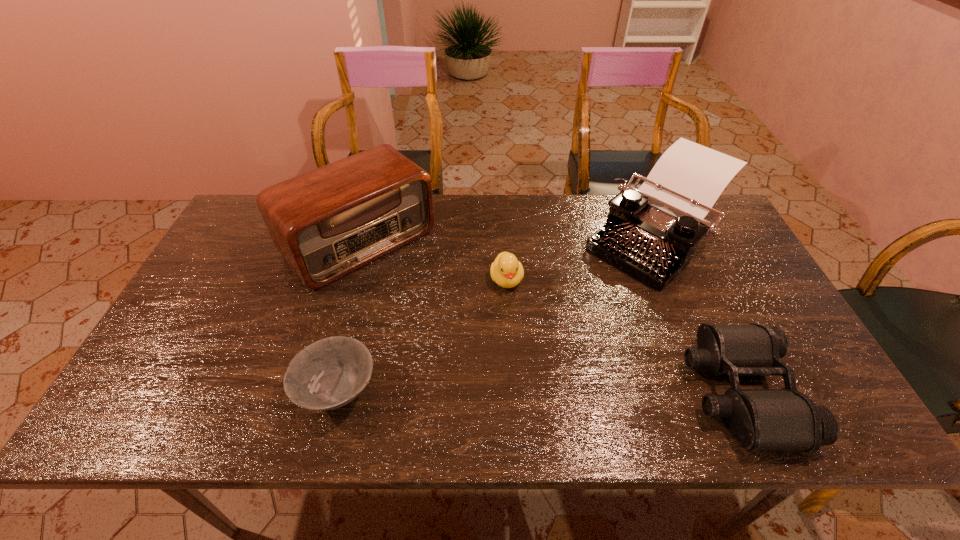
Image resolution: width=960 pixels, height=540 pixels. In order to click on bowl in this screenshot , I will do `click(327, 374)`.

The width and height of the screenshot is (960, 540). I want to click on binoculars, so click(x=760, y=419).

Locate an element on the screen. The image size is (960, 540). typewriter is located at coordinates (651, 233).

Image resolution: width=960 pixels, height=540 pixels. I want to click on radio receiver, so click(x=326, y=223).

At what (x,y) coordinates should I click in order to perform the action: click on the third object from left to right. Please return your answer as a coordinate pair (x, y). Looking at the image, I should click on (507, 272).

Identify the location of free space located on the back of the bowl. The image size is (960, 540). (366, 284).

This screenshot has height=540, width=960. Identify the location of free space located through the eyepieces of the binoculars. (651, 392).

This screenshot has width=960, height=540. Identify the location of blank space located through the eyepieces of the binoculars. (656, 392).

This screenshot has width=960, height=540. I want to click on vacant point located through the eyepieces of the binoculars, so click(x=576, y=392).

Locate an element on the screen. The height and width of the screenshot is (540, 960). free space located 0.260m on the keys of the typewriter is located at coordinates (559, 325).